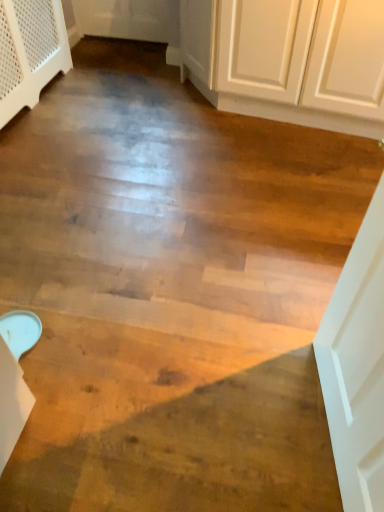
At what (x,y) coordinates should I click in order to perform the action: click on free space to the right of white textured dresser at upper left. Please return your answer as a coordinate pair (x, y). The image size is (384, 512). Looking at the image, I should click on (123, 103).